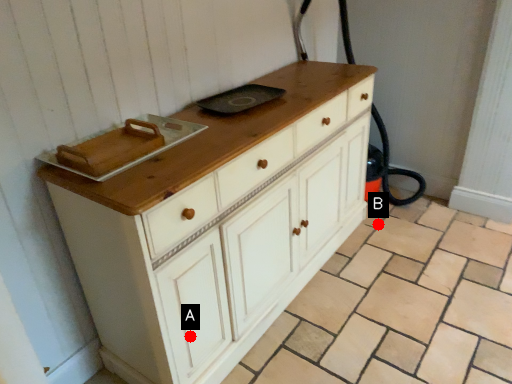
Question: Two points are circled on the image, labeled by A and B beside each circle. Which point is closer to the camera?

Choices:
 (A) A is closer
 (B) B is closer

Answer: (A)